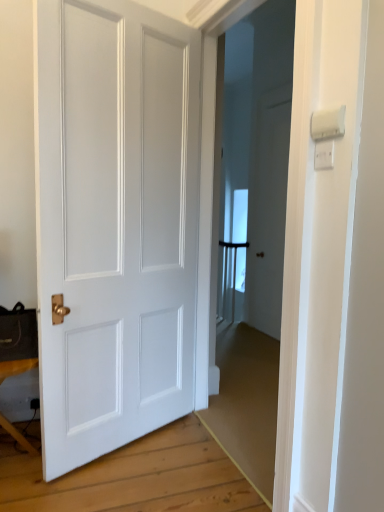
Question: Can you confirm if wooden table at lower left is taller than white matte door at center?

Choices:
 (A) no
 (B) yes

Answer: (A)

Question: Considering the relative positions of wooden table at lower left and white matte door at center in the image provided, is wooden table at lower left to the left of white matte door at center from the viewer's perspective?

Choices:
 (A) no
 (B) yes

Answer: (B)

Question: Considering the relative sizes of wooden table at lower left and white matte door at center in the image provided, is wooden table at lower left thinner than white matte door at center?

Choices:
 (A) no
 (B) yes

Answer: (A)

Question: Is wooden table at lower left positioned beyond the bounds of white matte door at center?

Choices:
 (A) no
 (B) yes

Answer: (B)

Question: Is wooden table at lower left bigger than white matte door at center?

Choices:
 (A) no
 (B) yes

Answer: (A)

Question: From a real-world perspective, is wooden table at lower left positioned over white matte door at center based on gravity?

Choices:
 (A) yes
 (B) no

Answer: (B)

Question: Can you confirm if white plastic light switch at upper right, which is the second light switch in top-to-bottom order, is taller than wooden table at lower left?

Choices:
 (A) yes
 (B) no

Answer: (B)

Question: From the image's perspective, is white plastic light switch at upper right, the first light switch in the bottom-to-top sequence, on wooden table at lower left?

Choices:
 (A) no
 (B) yes

Answer: (B)

Question: Considering the relative sizes of white plastic light switch at upper right, which is the second light switch in top-to-bottom order, and wooden table at lower left in the image provided, is white plastic light switch at upper right, which is the second light switch in top-to-bottom order, bigger than wooden table at lower left?

Choices:
 (A) yes
 (B) no

Answer: (B)

Question: Does white plastic light switch at upper right, which is the second light switch in top-to-bottom order, appear on the left side of wooden table at lower left?

Choices:
 (A) no
 (B) yes

Answer: (A)

Question: Is white plastic light switch at upper right, the first light switch in the bottom-to-top sequence, shorter than wooden table at lower left?

Choices:
 (A) yes
 (B) no

Answer: (A)

Question: Is there a large distance between white plastic light switch at upper right, the first light switch in the bottom-to-top sequence, and wooden table at lower left?

Choices:
 (A) yes
 (B) no

Answer: (A)

Question: Can white plastic light switch at upper right, the first light switch in the bottom-to-top sequence, be found inside white plastic light switch at upper right, which is the first light switch from top to bottom?

Choices:
 (A) no
 (B) yes

Answer: (A)